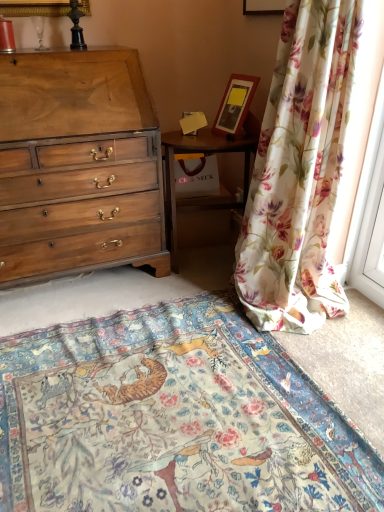
Question: Considering the positions of floral fabric curtain at right and floral carpet at center in the image, is floral fabric curtain at right taller or shorter than floral carpet at center?

Choices:
 (A) tall
 (B) short

Answer: (A)

Question: From a real-world perspective, is floral fabric curtain at right above or below floral carpet at center?

Choices:
 (A) below
 (B) above

Answer: (B)

Question: Which is nearer to the floral carpet at center?

Choices:
 (A) floral fabric curtain at right
 (B) wooden picture frame at upper center, the 2th picture frame from the bottom
 (C) wooden picture frame at upper right, which is the first picture frame in bottom-to-top order
 (D) wooden nightstand at center
 (E) light brown wood chest of drawers at left

Answer: (A)

Question: Estimate the real-world distances between objects in this image. Which object is closer to the wooden nightstand at center?

Choices:
 (A) floral carpet at center
 (B) wooden picture frame at upper right, which is the first picture frame in bottom-to-top order
 (C) wooden picture frame at upper center, which is the 1th picture frame in top-to-bottom order
 (D) light brown wood chest of drawers at left
 (E) floral fabric curtain at right

Answer: (B)